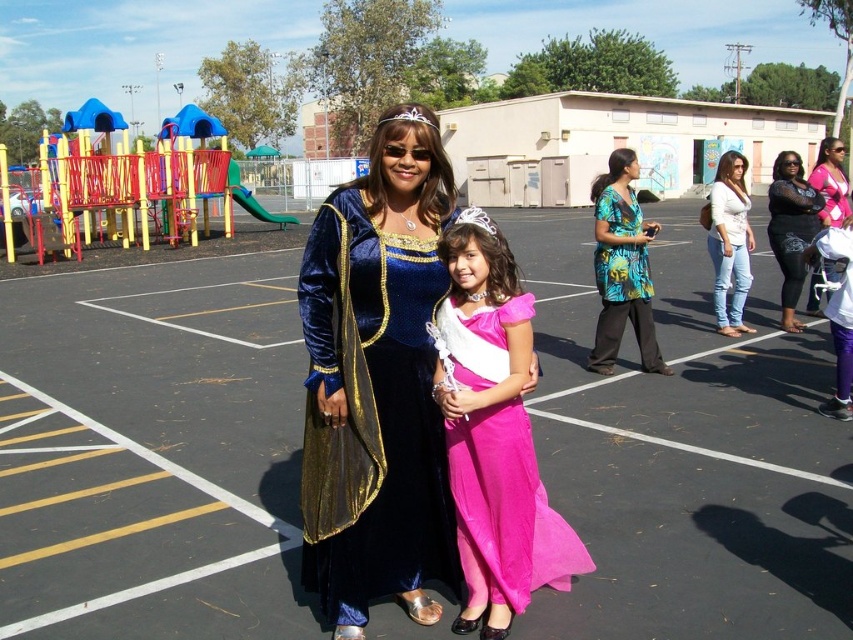
Question: Does black asphalt at center appear over floral print dress at center?

Choices:
 (A) yes
 (B) no

Answer: (B)

Question: Can you confirm if velvet blue dress at center is positioned to the left of pink satin dress at right?

Choices:
 (A) no
 (B) yes

Answer: (B)

Question: Which object is the farthest from the pink satin dress at center?

Choices:
 (A) floral print dress at center
 (B) matte black dress at right
 (C) pink satin dress at right
 (D) black asphalt at center

Answer: (B)

Question: Does floral print dress at center appear on the right side of pink satin dress at right?

Choices:
 (A) yes
 (B) no

Answer: (B)

Question: Estimate the real-world distances between objects in this image. Which object is farther from the velvet blue dress at center?

Choices:
 (A) matte black dress at right
 (B) pink satin dress at right
 (C) pink satin dress at center
 (D) floral print dress at center

Answer: (A)

Question: Among these points, which one is nearest to the camera?

Choices:
 (A) (793, 236)
 (B) (445, 557)
 (C) (631, 288)

Answer: (B)